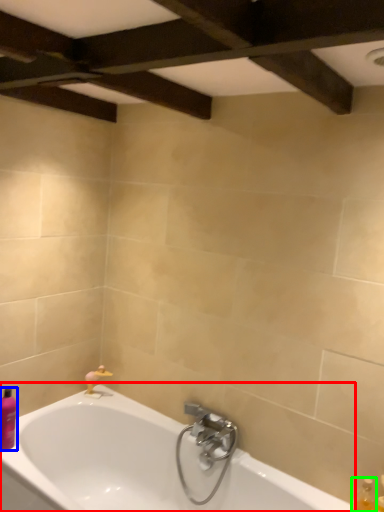
Question: Based on their relative distances, which object is farther from bathtub (highlighted by a red box)? Choose from toiletry (highlighted by a blue box) and bottle (highlighted by a green box).

Choices:
 (A) toiletry
 (B) bottle

Answer: (B)